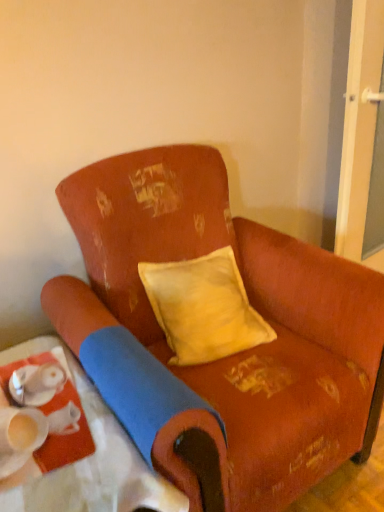
This screenshot has width=384, height=512. In order to click on transparent glass screen door at right in this screenshot , I will do `click(359, 125)`.

In order to face matte white tray at lower left, should I rotate leftwards or rightwards?

To align with it, rotate left about 15.425°.

The height and width of the screenshot is (512, 384). I want to click on matte white tray at lower left, so click(x=80, y=456).

Find the location of a particular element. This screenshot has height=512, width=384. transparent glass screen door at right is located at coordinates (359, 125).

Does matte white tray at lower left have a greater height compared to yellow velvet pillow at center?

Yes.

Considering the relative positions of matte white tray at lower left and yellow velvet pillow at center in the image provided, is matte white tray at lower left to the left of yellow velvet pillow at center from the viewer's perspective?

Yes.

Is the surface of matte white tray at lower left in direct contact with yellow velvet pillow at center?

No, matte white tray at lower left is not making contact with yellow velvet pillow at center.

How far apart are matte white tray at lower left and yellow velvet pillow at center?

The distance of matte white tray at lower left from yellow velvet pillow at center is 18.41 inches.

Which is correct: transparent glass screen door at right is inside worn fabric chair at center, or outside of it?

transparent glass screen door at right is located beyond the bounds of worn fabric chair at center.

This screenshot has width=384, height=512. Identify the location of screen door behind the worn fabric chair at center. (359, 125).

From a real-world perspective, which object stands above the other?

transparent glass screen door at right.

Can you confirm if worn fabric chair at center is positioned to the right of transparent glass screen door at right?

No, worn fabric chair at center is not to the right of transparent glass screen door at right.

Can you confirm if worn fabric chair at center is thinner than transparent glass screen door at right?

No, worn fabric chair at center is not thinner than transparent glass screen door at right.

Are worn fabric chair at center and transparent glass screen door at right located far from each other?

They are positioned close to each other.

Is worn fabric chair at center positioned with its back to matte white tray at lower left?

No.

Considering the sizes of objects worn fabric chair at center and matte white tray at lower left in the image provided, who is smaller, worn fabric chair at center or matte white tray at lower left?

With smaller size is matte white tray at lower left.

Is worn fabric chair at center directly adjacent to matte white tray at lower left?

They are not placed beside each other.

In the image, is worn fabric chair at center positioned in front of or behind matte white tray at lower left?

In the image, worn fabric chair at center appears in front of matte white tray at lower left.

In terms of height, does matte white tray at lower left look taller or shorter compared to worn fabric chair at center?

matte white tray at lower left is shorter than worn fabric chair at center.

Are matte white tray at lower left and worn fabric chair at center making contact?

There is a gap between matte white tray at lower left and worn fabric chair at center.

Between matte white tray at lower left and worn fabric chair at center, which one is positioned behind?

matte white tray at lower left is further away from the camera.

Does matte white tray at lower left appear on the right side of worn fabric chair at center?

No.

Is yellow velvet pillow at center with worn fabric chair at center?

No, yellow velvet pillow at center is not touching worn fabric chair at center.

From a real-world perspective, which is physically below, yellow velvet pillow at center or worn fabric chair at center?

In real-world perspective, worn fabric chair at center is lower.

Considering the points (180, 327) and (210, 186), which point is in front, point (180, 327) or point (210, 186)?

The point (180, 327) is closer to the camera.

From the image's perspective, which one is positioned lower, yellow velvet pillow at center or worn fabric chair at center?

worn fabric chair at center, from the image's perspective.

Could transparent glass screen door at right be considered to be inside yellow velvet pillow at center?

No, yellow velvet pillow at center does not contain transparent glass screen door at right.

Does yellow velvet pillow at center have a greater height compared to transparent glass screen door at right?

In fact, yellow velvet pillow at center may be shorter than transparent glass screen door at right.

From a real-world perspective, which is physically below, yellow velvet pillow at center or transparent glass screen door at right?

From a 3D spatial view, yellow velvet pillow at center is below.

The width and height of the screenshot is (384, 512). What are the coordinates of `pillow below the transparent glass screen door at right (from a real-world perspective)` in the screenshot? It's located at (203, 308).

The image size is (384, 512). I want to click on pillow on the right side of matte white tray at lower left, so click(203, 308).

Find the location of a particular element. screen door above the worn fabric chair at center (from a real-world perspective) is located at coordinates (359, 125).

Looking at this image, from the image, which object appears to be nearer to matte white tray at lower left, worn fabric chair at center or transparent glass screen door at right?

worn fabric chair at center.

When comparing their distances from yellow velvet pillow at center, does matte white tray at lower left or worn fabric chair at center seem further?

matte white tray at lower left lies further to yellow velvet pillow at center than the other object.

Which object lies nearer to the anchor point yellow velvet pillow at center, worn fabric chair at center or transparent glass screen door at right?

worn fabric chair at center is closer to yellow velvet pillow at center.

When comparing their distances from yellow velvet pillow at center, does transparent glass screen door at right or matte white tray at lower left seem further?

Among the two, transparent glass screen door at right is located further to yellow velvet pillow at center.

Looking at the image, which one is located closer to worn fabric chair at center, matte white tray at lower left or transparent glass screen door at right?

Based on the image, matte white tray at lower left appears to be nearer to worn fabric chair at center.

Looking at the image, which one is located further to transparent glass screen door at right, matte white tray at lower left or worn fabric chair at center?

matte white tray at lower left lies further to transparent glass screen door at right than the other object.

Considering their positions, is yellow velvet pillow at center positioned closer to transparent glass screen door at right than worn fabric chair at center?

yellow velvet pillow at center is positioned closer to the anchor transparent glass screen door at right.

Estimate the real-world distances between objects in this image. Which object is closer to matte white tray at lower left, transparent glass screen door at right or worn fabric chair at center?

Among the two, worn fabric chair at center is located nearer to matte white tray at lower left.

The height and width of the screenshot is (512, 384). I want to click on chair located between matte white tray at lower left and transparent glass screen door at right in the left-right direction, so coord(225,350).

Identify the location of chair between yellow velvet pillow at center and transparent glass screen door at right in the horizontal direction. (225, 350).

In order to click on table positioned between worn fabric chair at center and yellow velvet pillow at center from near to far in this screenshot , I will do `click(80, 456)`.

What are the coordinates of `pillow between matte white tray at lower left and transparent glass screen door at right` in the screenshot? It's located at (203, 308).